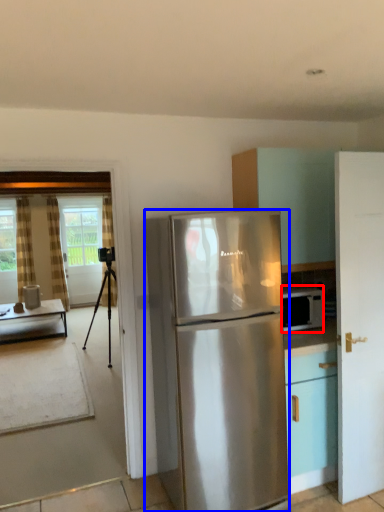
Question: Which object is further to the camera taking this photo, microwave oven (highlighted by a red box) or refrigerator (highlighted by a blue box)?

Choices:
 (A) microwave oven
 (B) refrigerator

Answer: (A)